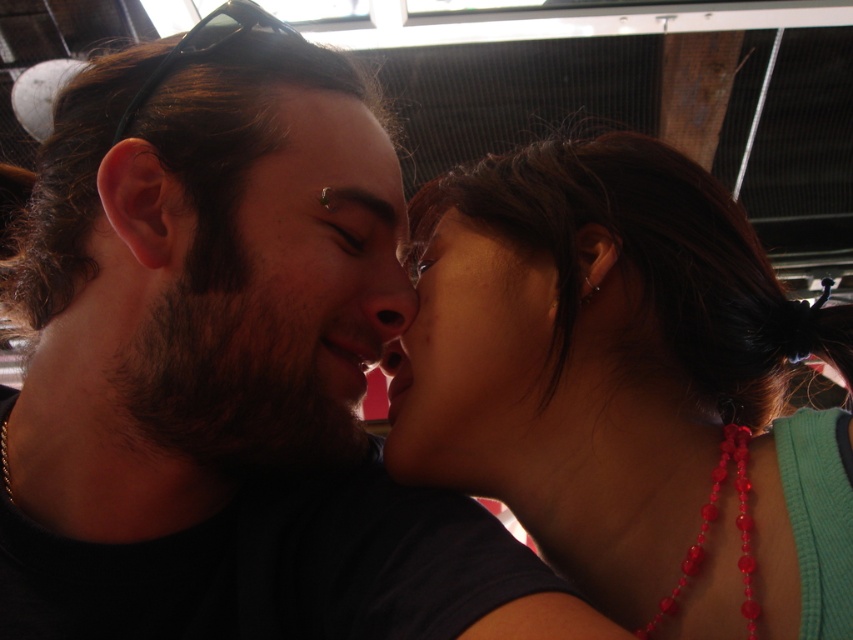
Between matte black shirt at center and smooth skin nose at center, which one appears on the right side from the viewer's perspective?

smooth skin nose at center is more to the right.

Can you confirm if matte black shirt at center is smaller than smooth skin nose at center?

No.

Is point (39, 401) farther from viewer compared to point (384, 321)?

No.

You are a GUI agent. You are given a task and a screenshot of the screen. Output one action in this format:
    pyautogui.click(x=<x>, y=<y>)
    Task: Click on the matte black shirt at center
    
    Given the screenshot: What is the action you would take?
    pyautogui.click(x=199, y=362)

Does smooth skin face at center come in front of translucent red beads at neck?

That is False.

Is smooth skin face at center behind translucent red beads at neck?

Yes.

Measure the distance between smooth skin face at center and camera.

A distance of 24.11 inches exists between smooth skin face at center and camera.

Where is `smooth skin face at center`? The image size is (853, 640). smooth skin face at center is located at coordinates (469, 362).

How distant is matte skin at center from translucent red beads at neck?

The distance of matte skin at center from translucent red beads at neck is 12.96 inches.

Who is more distant from viewer, (288,88) or (646,624)?

The point (288,88) is behind.

Locate an element on the screen. matte skin at center is located at coordinates (328, 147).